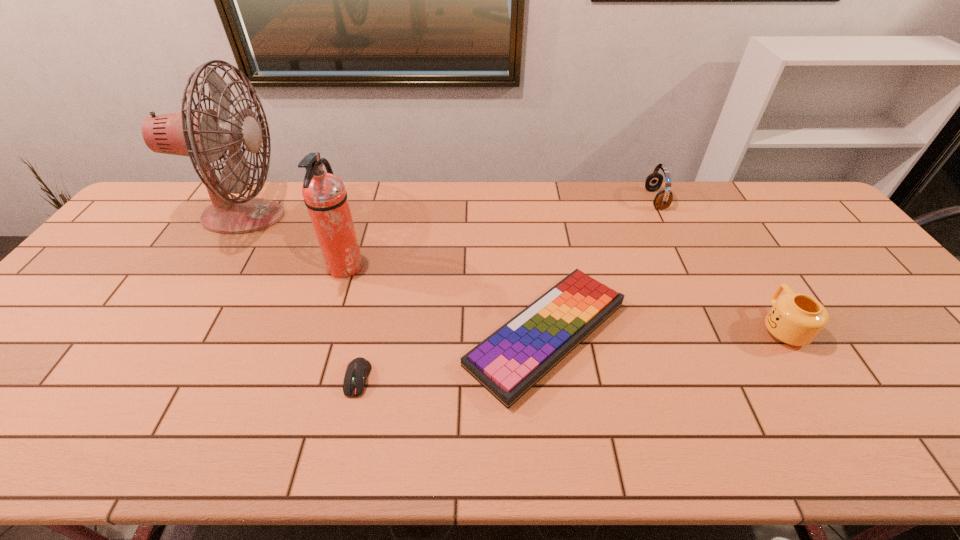
Identify the location of vacant area that lies between the fourth object from right to left and the second tallest object. (351, 323).

Where is `free spot between the leftmost object and the fire extinguisher`? This screenshot has width=960, height=540. free spot between the leftmost object and the fire extinguisher is located at coordinates (294, 242).

Choose which object is the second nearest neighbor to the headset. Please provide its 2D coordinates. Your answer should be formatted as a tuple, i.e. [(x, y)], where the tuple contains the x and y coordinates of a point satisfying the conditions above.

[(796, 319)]

Locate which object is the fifth closest to the second object from left to right. Please provide its 2D coordinates. Your answer should be formatted as a tuple, i.e. [(x, y)], where the tuple contains the x and y coordinates of a point satisfying the conditions above.

[(796, 319)]

Find the location of `vacant space that satisfies the following two spatial constraints: 1. in front of the tallest object to direct airflow; 2. on the left side of the second shortest object`. vacant space that satisfies the following two spatial constraints: 1. in front of the tallest object to direct airflow; 2. on the left side of the second shortest object is located at coordinates (170, 334).

Locate an element on the screen. This screenshot has width=960, height=540. free location that satisfies the following two spatial constraints: 1. at the nozzle of the fifth object from right to left; 2. on the handle side of the mug is located at coordinates (326, 327).

The height and width of the screenshot is (540, 960). I want to click on free space that satisfies the following two spatial constraints: 1. at the nozzle of the fifth shortest object; 2. on the handle side of the rightmost object, so click(x=326, y=327).

Find the location of a particular element. The height and width of the screenshot is (540, 960). free space in the image that satisfies the following two spatial constraints: 1. on the handle side of the mug; 2. at the nozzle of the fifth shortest object is located at coordinates (745, 267).

You are a GUI agent. You are given a task and a screenshot of the screen. Output one action in this format:
    pyautogui.click(x=<x>, y=<y>)
    Task: Click on the vacant space that satisfies the following two spatial constraints: 1. at the nozzle of the second object from left to right; 2. on the back side of the computer keyboard
    
    Given the screenshot: What is the action you would take?
    pyautogui.click(x=324, y=334)

This screenshot has height=540, width=960. Find the location of `vacant point that satisfies the following two spatial constraints: 1. on the handle side of the rightmost object; 2. in front of the tallest object to direct airflow`. vacant point that satisfies the following two spatial constraints: 1. on the handle side of the rightmost object; 2. in front of the tallest object to direct airflow is located at coordinates (714, 217).